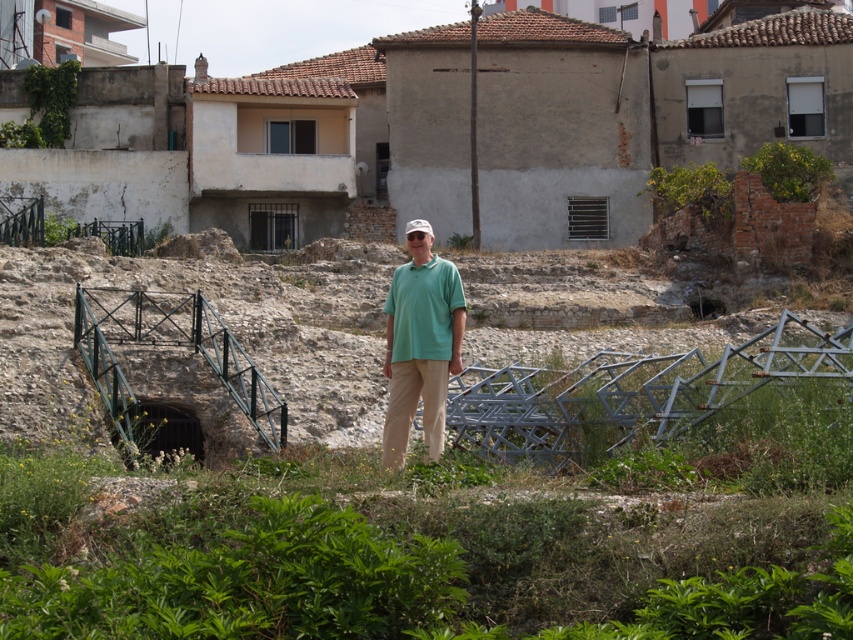
Does point (444, 333) come closer to viewer compared to point (410, 266)?

That is True.

Image resolution: width=853 pixels, height=640 pixels. What do you see at coordinates (421, 342) in the screenshot?
I see `green matte shirt at center` at bounding box center [421, 342].

Who is more forward, (434, 419) or (444, 316)?

Point (434, 419)

This screenshot has height=640, width=853. What are the coordinates of `green matte shirt at center` in the screenshot? It's located at (421, 342).